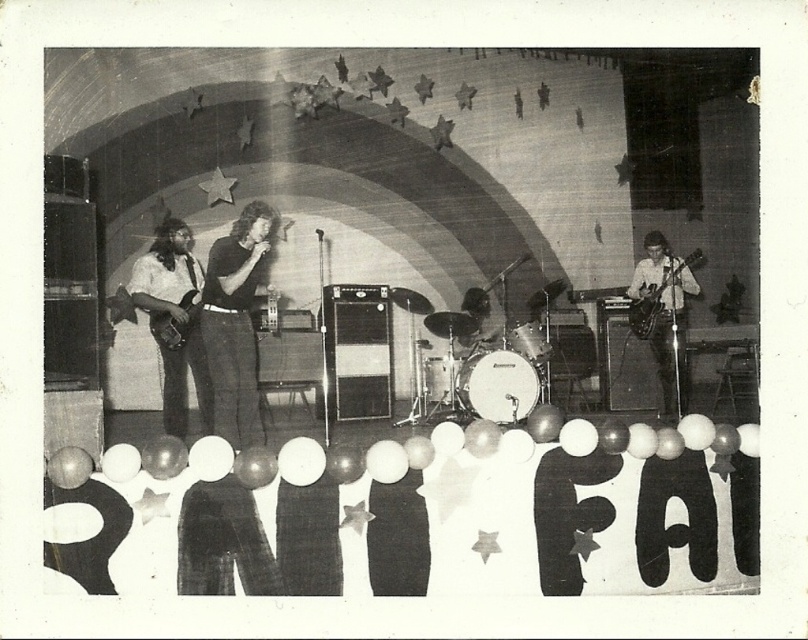
Can you confirm if shiny black guitar at left is bigger than metallic silver electric guitar at right?

Yes.

Is shiny black guitar at left wider than metallic silver electric guitar at right?

Correct, the width of shiny black guitar at left exceeds that of metallic silver electric guitar at right.

Measure the distance between shiny black guitar at left and camera.

A distance of 5.00 meters exists between shiny black guitar at left and camera.

The width and height of the screenshot is (808, 640). Find the location of `shiny black guitar at left`. shiny black guitar at left is located at coordinates (175, 321).

Who is more distant from viewer, (187,228) or (167,316)?

Positioned behind is point (187,228).

Does shiny black guitar at left have a greater width compared to shiny black electric guitar at left?

Yes.

Is point (198, 408) behind point (196, 301)?

Yes, point (198, 408) is behind point (196, 301).

At what (x,y) coordinates should I click in order to perform the action: click on shiny black guitar at left. Please return your answer as a coordinate pair (x, y). The width and height of the screenshot is (808, 640). Looking at the image, I should click on (175, 321).

Between smooth black shirt at center and shiny black electric guitar at left, which one has less height?

With less height is shiny black electric guitar at left.

Consider the image. Which is below, smooth black shirt at center or shiny black electric guitar at left?

smooth black shirt at center is below.

Is point (228, 384) farther from camera compared to point (160, 337)?

That is False.

Locate an element on the screen. This screenshot has width=808, height=640. smooth black shirt at center is located at coordinates (234, 324).